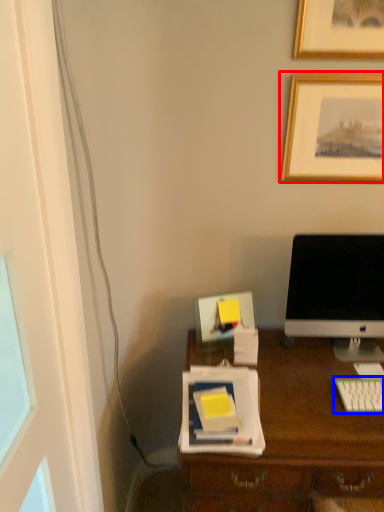
Question: Among these objects, which one is farthest to the camera, picture frame (highlighted by a red box) or computer keyboard (highlighted by a blue box)?

Choices:
 (A) picture frame
 (B) computer keyboard

Answer: (A)